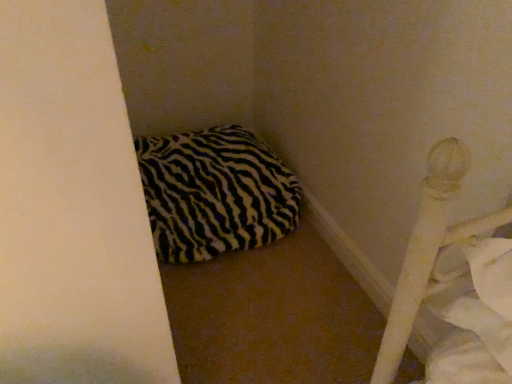
The height and width of the screenshot is (384, 512). What do you see at coordinates (215, 193) in the screenshot? I see `zebra-patterned pillow at lower left` at bounding box center [215, 193].

What are the coordinates of `zebra-patterned pillow at lower left` in the screenshot? It's located at (215, 193).

Locate an element on the screen. This screenshot has width=512, height=384. zebra-patterned pillow at lower left is located at coordinates (215, 193).